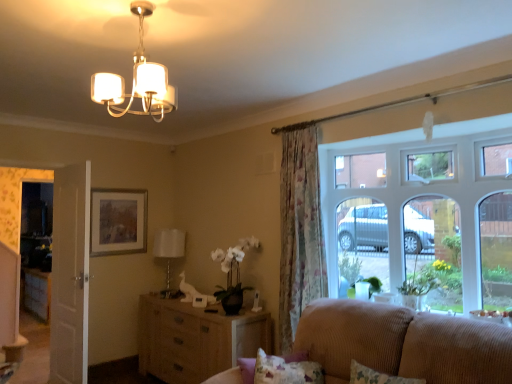
Question: From a real-world perspective, does fluffy fabric pillow at lower right stand above woven wood dresser at center?

Choices:
 (A) yes
 (B) no

Answer: (A)

Question: Is fluffy fabric pillow at lower right taller than woven wood dresser at center?

Choices:
 (A) no
 (B) yes

Answer: (A)

Question: Is woven wood dresser at center at the back of fluffy fabric pillow at lower right?

Choices:
 (A) yes
 (B) no

Answer: (B)

Question: Can you confirm if fluffy fabric pillow at lower right is smaller than woven wood dresser at center?

Choices:
 (A) no
 (B) yes

Answer: (B)

Question: Does fluffy fabric pillow at lower right lie behind woven wood dresser at center?

Choices:
 (A) no
 (B) yes

Answer: (A)

Question: Considering the relative sizes of fluffy fabric pillow at lower right and woven wood dresser at center in the image provided, is fluffy fabric pillow at lower right bigger than woven wood dresser at center?

Choices:
 (A) yes
 (B) no

Answer: (B)

Question: From the image's perspective, does beige corduroy couch at lower right appear lower than fluffy fabric pillow at lower right?

Choices:
 (A) yes
 (B) no

Answer: (A)

Question: Does beige corduroy couch at lower right come behind fluffy fabric pillow at lower right?

Choices:
 (A) no
 (B) yes

Answer: (A)

Question: Is the position of beige corduroy couch at lower right less distant than that of fluffy fabric pillow at lower right?

Choices:
 (A) yes
 (B) no

Answer: (A)

Question: Is beige corduroy couch at lower right shorter than fluffy fabric pillow at lower right?

Choices:
 (A) no
 (B) yes

Answer: (A)

Question: Is beige corduroy couch at lower right directly adjacent to fluffy fabric pillow at lower right?

Choices:
 (A) no
 (B) yes

Answer: (A)

Question: Could you tell me if beige corduroy couch at lower right is turned towards fluffy fabric pillow at lower right?

Choices:
 (A) yes
 (B) no

Answer: (A)

Question: Does white wooden door at left turn towards wooden picture frame at upper left?

Choices:
 (A) no
 (B) yes

Answer: (A)